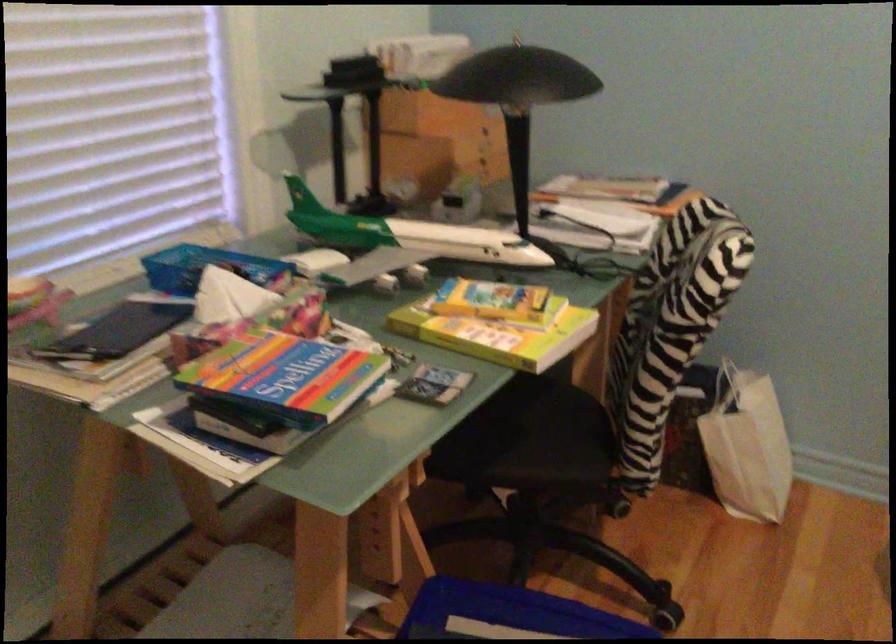
Locate an element on the screen. The image size is (896, 644). blue storage bin is located at coordinates (507, 614).